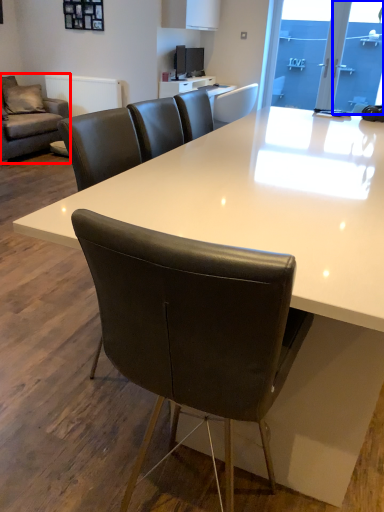
Question: Which of the following is the closest to the observer, studio couch (highlighted by a red box) or glass door (highlighted by a blue box)?

Choices:
 (A) studio couch
 (B) glass door

Answer: (A)